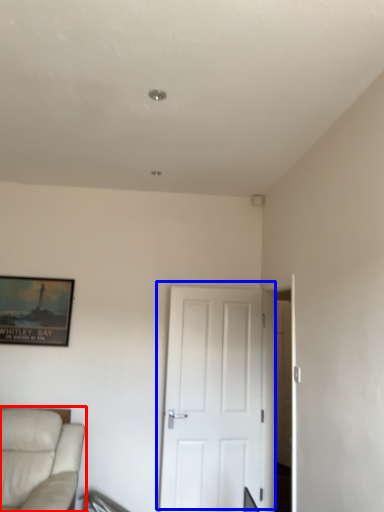
Question: Among these objects, which one is farthest to the camera, studio couch (highlighted by a red box) or door (highlighted by a blue box)?

Choices:
 (A) studio couch
 (B) door

Answer: (B)